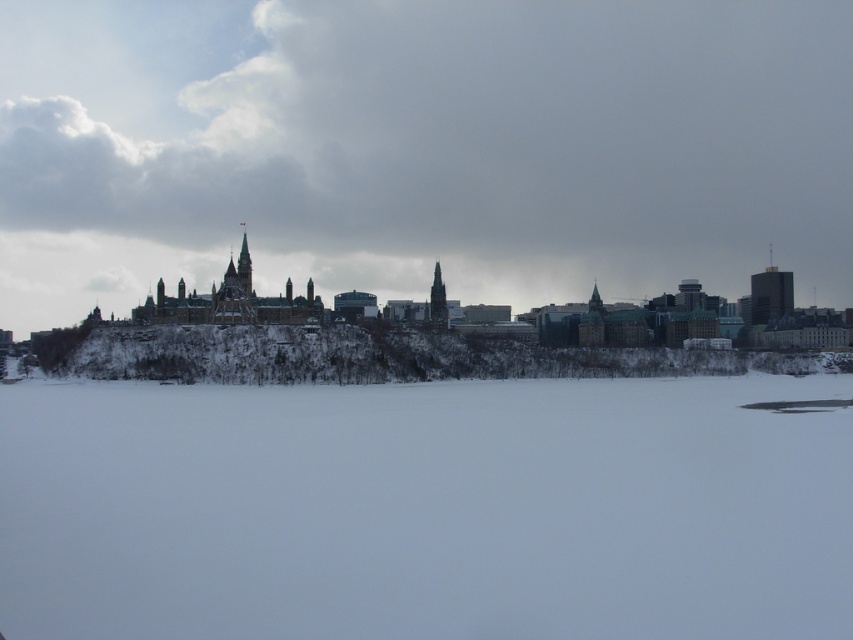
Question: Which point is farther to the camera?

Choices:
 (A) (283, 410)
 (B) (375, 364)
 (C) (596, 42)

Answer: (C)

Question: Does white fluffy cloud at upper center have a lesser width compared to snowy rocky hill at lower center?

Choices:
 (A) no
 (B) yes

Answer: (A)

Question: Estimate the real-world distances between objects in this image. Which object is farther from the white powdery snow at center?

Choices:
 (A) snowy rocky hill at lower center
 (B) white fluffy cloud at upper center

Answer: (B)

Question: Does white fluffy cloud at upper center appear on the right side of white powdery snow at center?

Choices:
 (A) yes
 (B) no

Answer: (A)

Question: Does white powdery snow at center have a greater width compared to snowy rocky hill at lower center?

Choices:
 (A) no
 (B) yes

Answer: (A)

Question: Which object is the closest to the white powdery snow at center?

Choices:
 (A) snowy rocky hill at lower center
 (B) white fluffy cloud at upper center

Answer: (A)